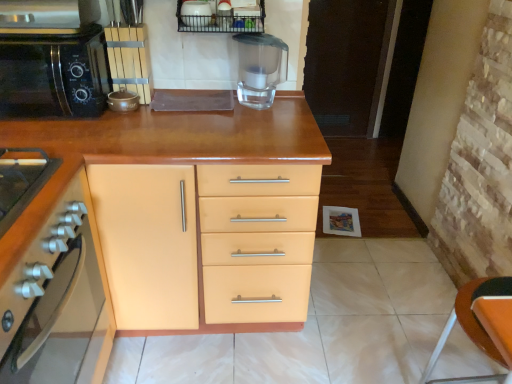
What do you see at coordinates (221, 16) in the screenshot? I see `metallic wire basket at upper center` at bounding box center [221, 16].

In order to face white glossy bowl at upper center, marked as the 2th appliance in a left-to-right arrangement, should I rotate leftwards or rightwards?

A 7.573 degree turn to the left will do.

You are a GUI agent. You are given a task and a screenshot of the screen. Output one action in this format:
    pyautogui.click(x=<x>, y=<y>)
    Task: Click on the matte wood cabinet at center, which is the 1th cabinetry in back-to-front order
    
    Given the screenshot: What is the action you would take?
    pyautogui.click(x=162, y=230)

Find the location of `transparent plastic blender at center`. transparent plastic blender at center is located at coordinates (260, 68).

Describe the element at coordinates (123, 100) in the screenshot. I see `matte brown pot at upper left, which ranks as the 2th appliance in top-to-bottom order` at that location.

What are the coordinates of `metallic wire basket at upper center` in the screenshot? It's located at (221, 16).

Consider the image. Which object is more forward, black matte microwave at left or metallic wire basket at upper center?

black matte microwave at left.

How many degrees apart are the facing directions of black matte microwave at left and metallic wire basket at upper center?

black matte microwave at left and metallic wire basket at upper center are facing 1.03 degrees away from each other.

Would you say metallic wire basket at upper center is part of black matte microwave at left's contents?

No, metallic wire basket at upper center is not inside black matte microwave at left.

From the image's perspective, which is above, black matte microwave at left or metallic wire basket at upper center?

metallic wire basket at upper center is shown above in the image.

Considering the positions of objects transparent plastic blender at center and matte brown pot at upper left, positioned as the 1th appliance in left-to-right order, in the image provided, who is more to the left, transparent plastic blender at center or matte brown pot at upper left, positioned as the 1th appliance in left-to-right order,?

From the viewer's perspective, matte brown pot at upper left, positioned as the 1th appliance in left-to-right order, appears more on the left side.

Does transparent plastic blender at center have a greater height compared to matte brown pot at upper left, positioned as the 1th appliance in left-to-right order?

Yes, transparent plastic blender at center is taller than matte brown pot at upper left, positioned as the 1th appliance in left-to-right order.

Considering the sizes of objects transparent plastic blender at center and matte brown pot at upper left, arranged as the 2th appliance when viewed from the right, in the image provided, who is thinner, transparent plastic blender at center or matte brown pot at upper left, arranged as the 2th appliance when viewed from the right,?

matte brown pot at upper left, arranged as the 2th appliance when viewed from the right, is thinner.

Could you tell me if transparent plastic blender at center is turned towards matte brown pot at upper left, arranged as the 2th appliance when viewed from the right?

No, transparent plastic blender at center does not turn towards matte brown pot at upper left, arranged as the 2th appliance when viewed from the right.

How distant is matte wood cabinet at center, the 2th cabinetry when ordered from front to back, from metallic wire basket at upper center?

matte wood cabinet at center, the 2th cabinetry when ordered from front to back, and metallic wire basket at upper center are 27.31 inches apart from each other.

Is the depth of matte wood cabinet at center, which is the 1th cabinetry in back-to-front order, greater than that of metallic wire basket at upper center?

No, matte wood cabinet at center, which is the 1th cabinetry in back-to-front order, is closer to the camera.

Is matte wood cabinet at center, which is the 1th cabinetry in back-to-front order, at the left side of metallic wire basket at upper center?

Indeed, matte wood cabinet at center, which is the 1th cabinetry in back-to-front order, is positioned on the left side of metallic wire basket at upper center.

Would you say black matte microwave at left is part of transparent plastic blender at center's contents?

Actually, black matte microwave at left is outside transparent plastic blender at center.

Is transparent plastic blender at center not near black matte microwave at left?

Actually, transparent plastic blender at center and black matte microwave at left are a little close together.

Who is more distant, transparent plastic blender at center or black matte microwave at left?

transparent plastic blender at center is behind.

From the image's perspective, which one is positioned higher, transparent plastic blender at center or black matte microwave at left?

transparent plastic blender at center.

How different are the orientations of matte orange cabinet at left, which is the 1th cabinetry in front-to-back order, and metallic wire basket at upper center in degrees?

matte orange cabinet at left, which is the 1th cabinetry in front-to-back order, and metallic wire basket at upper center are facing 89.9 degrees away from each other.

Can you confirm if matte orange cabinet at left, the 2th cabinetry viewed from the back, is smaller than metallic wire basket at upper center?

Incorrect, matte orange cabinet at left, the 2th cabinetry viewed from the back, is not smaller in size than metallic wire basket at upper center.

Is matte orange cabinet at left, which is the 1th cabinetry in front-to-back order, not near metallic wire basket at upper center?

No, matte orange cabinet at left, which is the 1th cabinetry in front-to-back order, is not far from metallic wire basket at upper center.

Considering the relative sizes of matte orange cabinet at left, the 2th cabinetry viewed from the back, and metallic wire basket at upper center in the image provided, is matte orange cabinet at left, the 2th cabinetry viewed from the back, wider than metallic wire basket at upper center?

Indeed, matte orange cabinet at left, the 2th cabinetry viewed from the back, has a greater width compared to metallic wire basket at upper center.

From a real-world perspective, is transparent plastic blender at center above or below matte wood cabinet at center, the 2th cabinetry when ordered from front to back?

In terms of real-world spatial position, transparent plastic blender at center is above matte wood cabinet at center, the 2th cabinetry when ordered from front to back.

Which object is more forward, transparent plastic blender at center or matte wood cabinet at center, the 2th cabinetry when ordered from front to back?

Positioned in front is matte wood cabinet at center, the 2th cabinetry when ordered from front to back.

Find the location of `cabinetry that is the 1st object located in front of the transparent plastic blender at center`. cabinetry that is the 1st object located in front of the transparent plastic blender at center is located at coordinates (162, 230).

Which is more to the left, black matte microwave at left or matte brown pot at upper left, arranged as the 2th appliance when viewed from the right?

From the viewer's perspective, black matte microwave at left appears more on the left side.

From a real-world perspective, is black matte microwave at left below matte brown pot at upper left, which ranks as the 2th appliance in top-to-bottom order?

No.

Does black matte microwave at left have a greater width compared to matte brown pot at upper left, arranged as the 2th appliance when viewed from the right?

Indeed, black matte microwave at left has a greater width compared to matte brown pot at upper left, arranged as the 2th appliance when viewed from the right.

Considering the sizes of objects black matte microwave at left and matte brown pot at upper left, the first appliance from the bottom, in the image provided, who is taller, black matte microwave at left or matte brown pot at upper left, the first appliance from the bottom,?

black matte microwave at left.

I want to click on home appliance below the metallic wire basket at upper center (from the image's perspective), so click(x=54, y=74).

Locate an element on the screen. appliance that appears below the transparent plastic blender at center (from a real-world perspective) is located at coordinates (123, 100).

From the image, which object appears to be nearer to black matte microwave at left, white glossy bowl at upper center, marked as the first appliance in a right-to-left arrangement, or transparent plastic blender at center?

white glossy bowl at upper center, marked as the first appliance in a right-to-left arrangement, is positioned closer to the anchor black matte microwave at left.

Considering their positions, is matte orange cabinet at left, which is the 1th cabinetry in front-to-back order, positioned closer to metallic wire basket at upper center than black matte microwave at left?

Among the two, black matte microwave at left is located nearer to metallic wire basket at upper center.

Considering their positions, is matte brown pot at upper left, which ranks as the 2th appliance in top-to-bottom order, positioned further to white glossy bowl at upper center, marked as the 2th appliance in a left-to-right arrangement, than matte wood cabinet at center, which is the 1th cabinetry in back-to-front order?

Based on the image, matte wood cabinet at center, which is the 1th cabinetry in back-to-front order, appears to be further to white glossy bowl at upper center, marked as the 2th appliance in a left-to-right arrangement.

Which object lies further to the anchor point black matte microwave at left, white glossy bowl at upper center, marked as the 2th appliance in a left-to-right arrangement, or matte wood cabinet at center, which is the 1th cabinetry in back-to-front order?

The object further to black matte microwave at left is white glossy bowl at upper center, marked as the 2th appliance in a left-to-right arrangement.

From the image, which object appears to be nearer to matte orange cabinet at left, which is the 1th cabinetry in front-to-back order, metallic wire basket at upper center or white glossy bowl at upper center, marked as the 2th appliance in a left-to-right arrangement?

Among the two, metallic wire basket at upper center is located nearer to matte orange cabinet at left, which is the 1th cabinetry in front-to-back order.

Which object lies further to the anchor point transparent plastic blender at center, matte orange cabinet at left, which is the 1th cabinetry in front-to-back order, or matte wood cabinet at center, which is the 1th cabinetry in back-to-front order?

Based on the image, matte orange cabinet at left, which is the 1th cabinetry in front-to-back order, appears to be further to transparent plastic blender at center.

Estimate the real-world distances between objects in this image. Which object is closer to matte wood cabinet at center, which is the 1th cabinetry in back-to-front order, transparent plastic blender at center or matte brown pot at upper left, positioned as the 1th appliance in left-to-right order?

matte brown pot at upper left, positioned as the 1th appliance in left-to-right order, lies closer to matte wood cabinet at center, which is the 1th cabinetry in back-to-front order, than the other object.

When comparing their distances from transparent plastic blender at center, does metallic wire basket at upper center or matte brown pot at upper left, positioned as the 1th appliance in left-to-right order, seem closer?

metallic wire basket at upper center is positioned closer to the anchor transparent plastic blender at center.

You are a GUI agent. You are given a task and a screenshot of the screen. Output one action in this format:
    pyautogui.click(x=<x>, y=<y>)
    Task: Click on the home appliance between metallic wire basket at upper center and matte wood cabinet at center, the 2th cabinetry when ordered from front to back, in the up-down direction
    The height and width of the screenshot is (384, 512).
    Given the screenshot: What is the action you would take?
    pyautogui.click(x=54, y=74)

Identify the location of appliance situated between black matte microwave at left and white glossy bowl at upper center, marked as the 2th appliance in a left-to-right arrangement, from left to right. This screenshot has width=512, height=384. (123, 100).

At what (x,y) coordinates should I click in order to perform the action: click on cabinetry between metallic wire basket at upper center and matte orange cabinet at left, the 2th cabinetry viewed from the back, in the up-down direction. Please return your answer as a coordinate pair (x, y). Looking at the image, I should click on (162, 230).

Where is `appliance that lies between metallic wire basket at upper center and matte orange cabinet at left, the 2th cabinetry viewed from the back, from top to bottom`? This screenshot has height=384, width=512. appliance that lies between metallic wire basket at upper center and matte orange cabinet at left, the 2th cabinetry viewed from the back, from top to bottom is located at coordinates (123, 100).